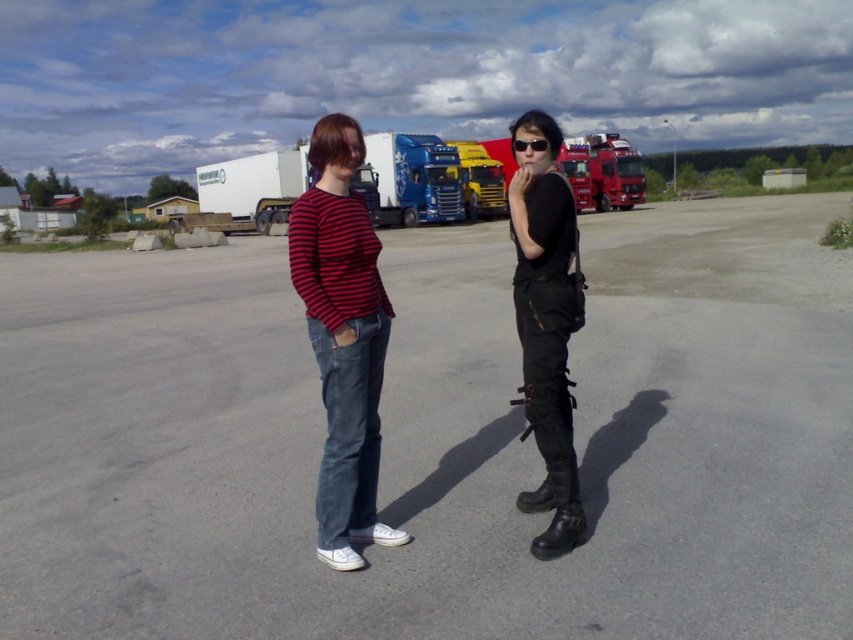
Which is more to the right, black leather boots at center or black plastic sunglasses at center?

black leather boots at center

Does black leather boots at center appear on the right side of black plastic sunglasses at center?

Indeed, black leather boots at center is positioned on the right side of black plastic sunglasses at center.

The image size is (853, 640). Identify the location of black leather boots at center. (546, 339).

At what (x,y) coordinates should I click in order to perform the action: click on black leather boots at center. Please return your answer as a coordinate pair (x, y). The image size is (853, 640). Looking at the image, I should click on (546, 339).

Is point (369, 289) positioned after point (532, 120)?

That is False.

Does matte black shirt at center lie behind black leather boots at center?

No.

Identify the location of matte black shirt at center. Image resolution: width=853 pixels, height=640 pixels. (343, 339).

Between matte black shirt at center and black plastic sunglasses at center, which one has less height?

black plastic sunglasses at center

Does matte black shirt at center appear over black plastic sunglasses at center?

No, matte black shirt at center is not above black plastic sunglasses at center.

Is point (338, 320) closer to camera compared to point (515, 141)?

Yes, point (338, 320) is in front of point (515, 141).

The width and height of the screenshot is (853, 640). I want to click on matte black shirt at center, so click(x=343, y=339).